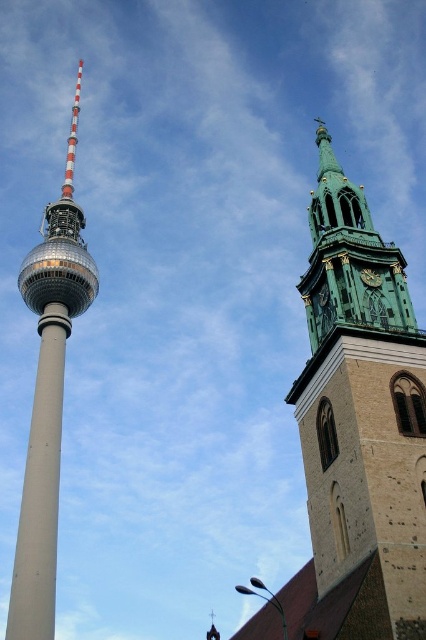
You are a photographer planning to capture both the green patina steeple at right and the smooth gray pole at left in a single shot. Based on their heights, which structure should you position closer to the center of your camera frame to ensure both are fully visible?

The green patina steeple at right is taller than the smooth gray pole at left. To ensure both structures are fully visible in the frame, you should position the green patina steeple at right closer to the center of the camera frame.

Looking at this image, you are a drone operator planning to fly a drone between the green patina steeple at right and the dark green stone clock at upper right. The drone has a wingspan of 1.2 meters. Based on the scene, will the drone be able to pass through the space between them?

The distance between the green patina steeple at right and the dark green stone clock at upper right is 9.67 meters. Since the drone has a wingspan of 1.2 meters, it will easily fit through the space between them.

You are a tourist standing in front of the Fernsehturm and want to take a photo of the St. Marienkirche. In the background, you notice the dark green stone clock at upper right and the green patina steeple at right. Which of these two objects should you focus on to ensure the steeple is centered in your photo?

The green patina steeple at right is to the right of the dark green stone clock at upper right. To center the steeple in your photo, focus on the green patina steeple at right since it is positioned further to the right compared to the dark green stone clock at upper right.